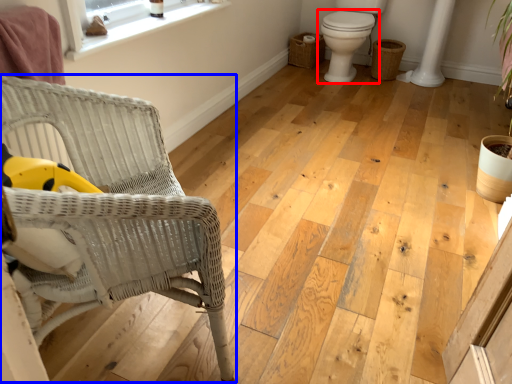
Question: Which object is closer to the camera taking this photo, toilet (highlighted by a red box) or chair (highlighted by a blue box)?

Choices:
 (A) toilet
 (B) chair

Answer: (B)